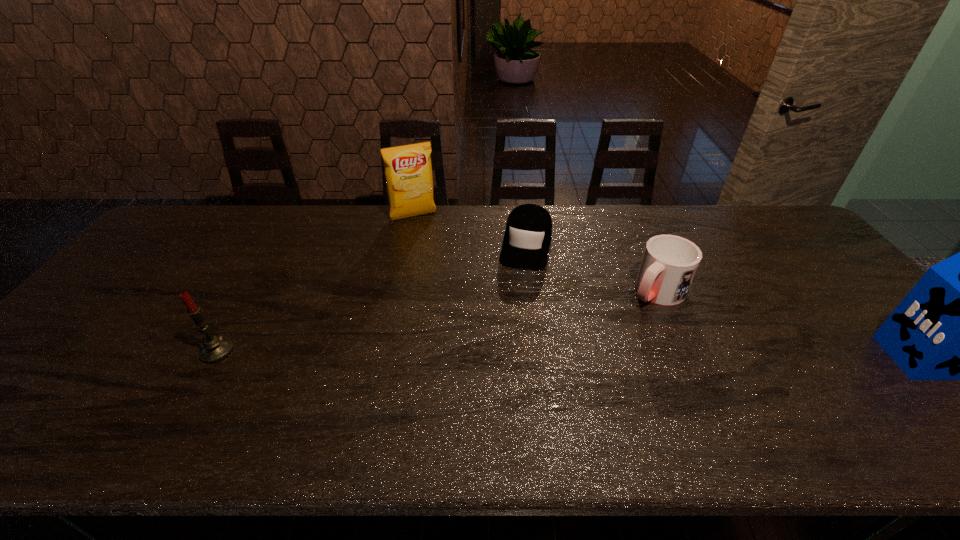
Locate an element on the screen. free space on the desktop that is between the candle and the tallest object and is positioned on the side of the third farthest object with the handle is located at coordinates (588, 354).

This screenshot has width=960, height=540. Find the location of `vacant space on the desktop that is between the candle and the rightmost object and is positioned on the front-facing side of the cap`. vacant space on the desktop that is between the candle and the rightmost object and is positioned on the front-facing side of the cap is located at coordinates (499, 354).

Find the location of `free space on the desktop that is between the leftmost object and the rightmost object and is positioned on the front of the fourth object from right to left with the logo`. free space on the desktop that is between the leftmost object and the rightmost object and is positioned on the front of the fourth object from right to left with the logo is located at coordinates tap(480, 354).